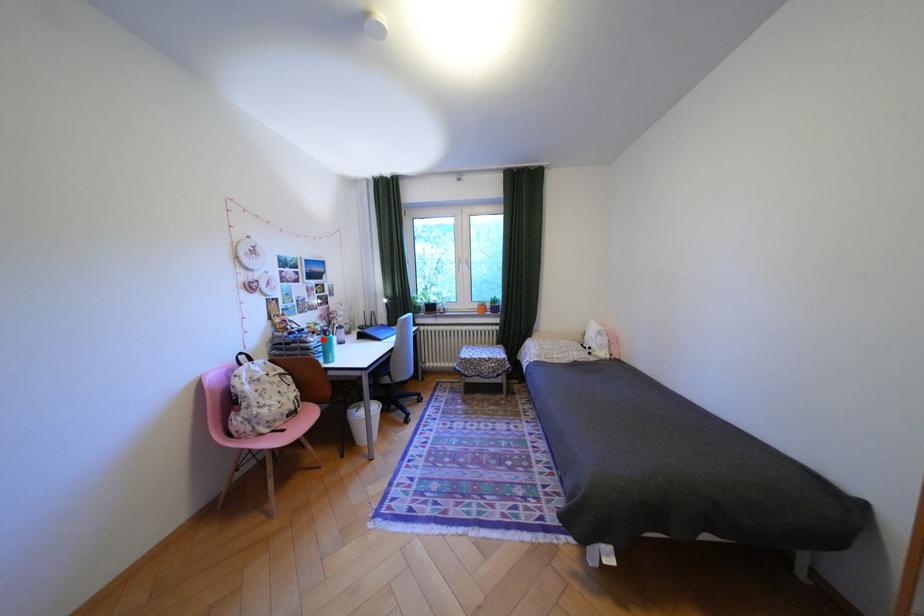
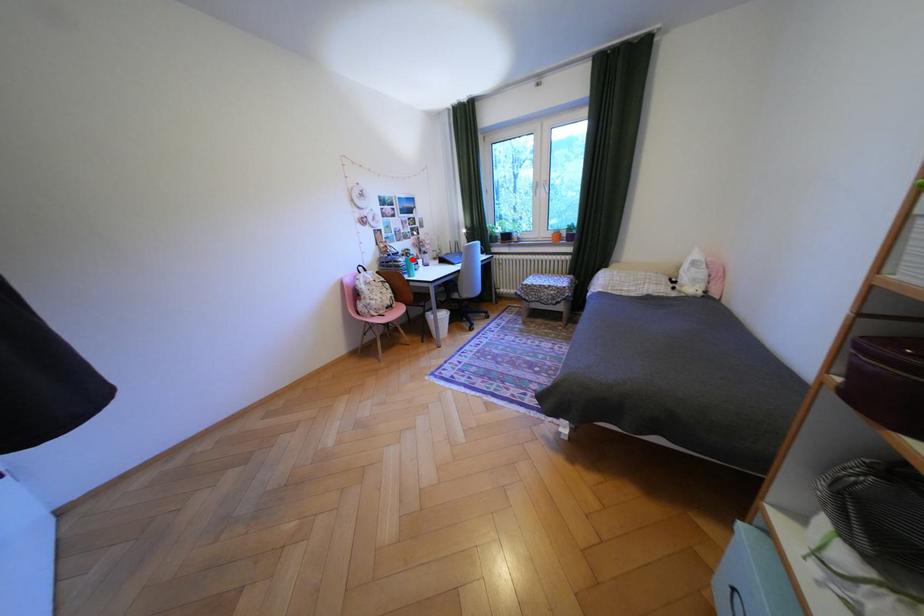
I am providing you with two images of the same scene from different viewpoints. A red point is marked on the first image and another point is marked on the second image. Is the marked point in image1 the same physical position as the marked point in image2?

Yes